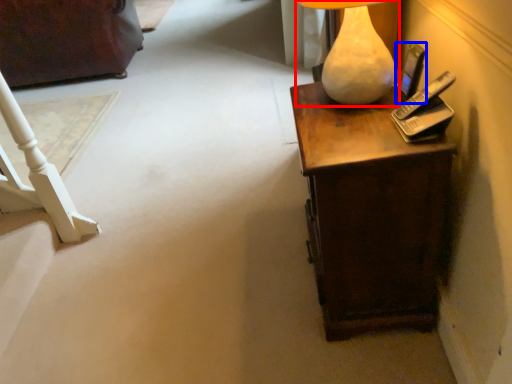
Question: Which point is further to the camera, lamp (highlighted by a red box) or mobile phone (highlighted by a blue box)?

Choices:
 (A) lamp
 (B) mobile phone

Answer: (B)